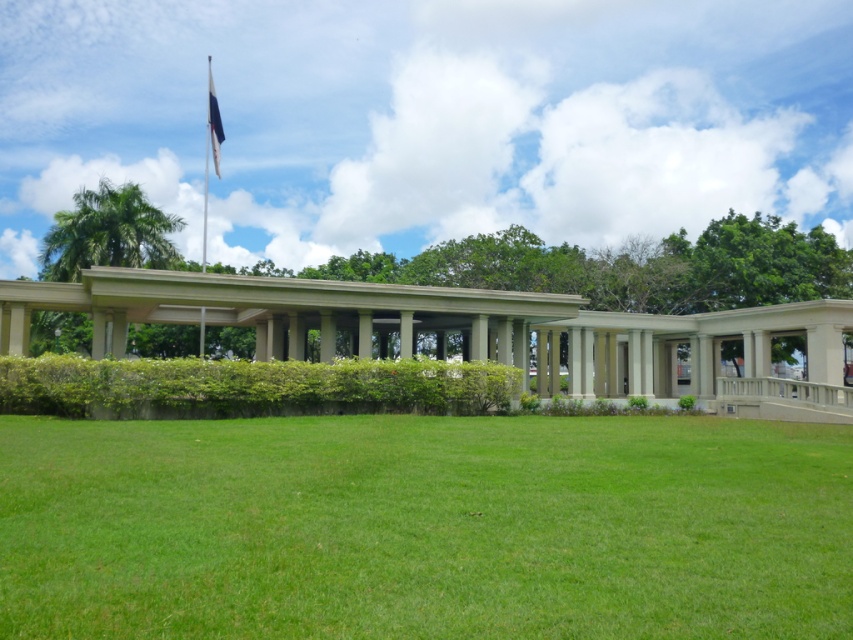
Can you confirm if green grass at lower center is smaller than beige concrete porch at center?

Yes, green grass at lower center is smaller than beige concrete porch at center.

Who is lower down, green grass at lower center or beige concrete porch at center?

green grass at lower center is below.

Which is in front, point (547, 557) or point (792, 381)?

Point (547, 557) is more forward.

The width and height of the screenshot is (853, 640). I want to click on green grass at lower center, so click(x=424, y=528).

Does green grass at lower center come in front of blue fabric flag at upper center?

Yes, it is in front of blue fabric flag at upper center.

Who is more distant from viewer, (50, 438) or (216, 145)?

Point (216, 145)

You are a GUI agent. You are given a task and a screenshot of the screen. Output one action in this format:
    pyautogui.click(x=<x>, y=<y>)
    Task: Click on the green grass at lower center
    This screenshot has width=853, height=640.
    Given the screenshot: What is the action you would take?
    pyautogui.click(x=424, y=528)

Is beige concrete porch at center thinner than blue fabric flag at upper center?

No, beige concrete porch at center is not thinner than blue fabric flag at upper center.

Locate an element on the screen. The height and width of the screenshot is (640, 853). beige concrete porch at center is located at coordinates (468, 332).